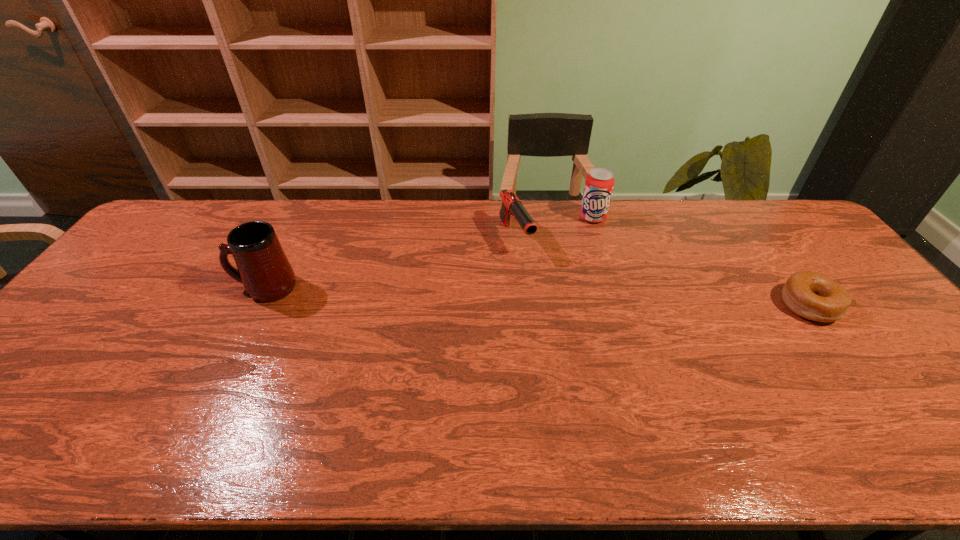
You are a GUI agent. You are given a task and a screenshot of the screen. Output one action in this format:
    pyautogui.click(x=<x>, y=<y>)
    Task: Click on the free space on the desktop that is between the leftmost object and the bagel and is positioned at the aiming end of the gun
    
    Given the screenshot: What is the action you would take?
    pyautogui.click(x=554, y=297)

Where is `free space on the desktop that is between the leftmost object and the rightmost object and is positioned on the surface of the soda can`? free space on the desktop that is between the leftmost object and the rightmost object and is positioned on the surface of the soda can is located at coordinates (564, 298).